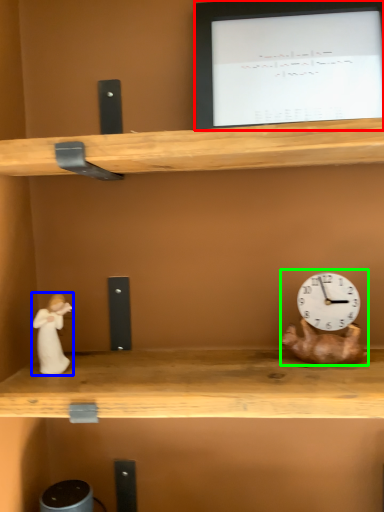
Question: Estimate the real-world distances between objects in this image. Which object is closer to computer monitor (highlighted by a red box), couple (highlighted by a blue box) or toy (highlighted by a green box)?

Choices:
 (A) couple
 (B) toy

Answer: (B)